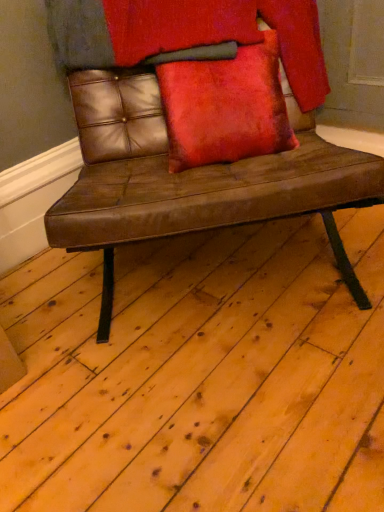
Question: Can you confirm if brown leather bench at center is shorter than velvet red pillow at center?

Choices:
 (A) yes
 (B) no

Answer: (B)

Question: From the image's perspective, is brown leather bench at center above velvet red pillow at center?

Choices:
 (A) no
 (B) yes

Answer: (A)

Question: Can you confirm if brown leather bench at center is wider than velvet red pillow at center?

Choices:
 (A) yes
 (B) no

Answer: (A)

Question: From a real-world perspective, is brown leather bench at center under velvet red pillow at center?

Choices:
 (A) yes
 (B) no

Answer: (A)

Question: Is brown leather bench at center smaller than velvet red pillow at center?

Choices:
 (A) no
 (B) yes

Answer: (A)

Question: Would you say brown leather bench at center contains velvet red pillow at center?

Choices:
 (A) yes
 (B) no

Answer: (A)

Question: Considering the relative sizes of velvet red pillow at center and brown leather bench at center in the image provided, is velvet red pillow at center smaller than brown leather bench at center?

Choices:
 (A) yes
 (B) no

Answer: (A)

Question: Is velvet red pillow at center to the right of brown leather bench at center from the viewer's perspective?

Choices:
 (A) yes
 (B) no

Answer: (A)

Question: Does velvet red pillow at center have a greater width compared to brown leather bench at center?

Choices:
 (A) yes
 (B) no

Answer: (B)

Question: Is velvet red pillow at center not inside brown leather bench at center?

Choices:
 (A) yes
 (B) no

Answer: (B)

Question: Does velvet red pillow at center lie in front of brown leather bench at center?

Choices:
 (A) no
 (B) yes

Answer: (A)

Question: Does velvet red pillow at center have a lesser height compared to brown leather bench at center?

Choices:
 (A) no
 (B) yes

Answer: (B)

Question: Is brown leather bench at center spatially inside velvet red pillow at center, or outside of it?

Choices:
 (A) outside
 (B) inside

Answer: (A)